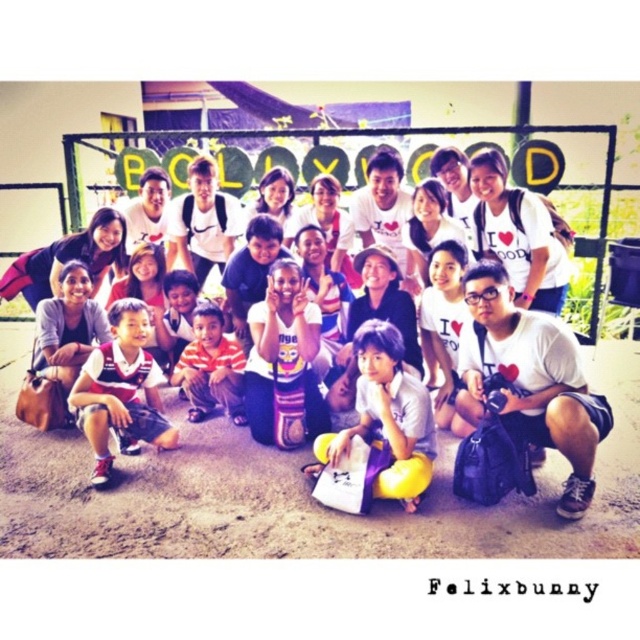
Question: Considering the real-world distances, which object is closest to the striped fabric pants at center?

Choices:
 (A) striped jersey at lower left
 (B) yellow fabric pants at lower center

Answer: (A)

Question: Is white cotton t-shirt at center closer to the viewer compared to striped jersey at lower left?

Choices:
 (A) no
 (B) yes

Answer: (B)

Question: Which point is closer to the camera?

Choices:
 (A) striped jersey at lower left
 (B) white matte plush toy at center
 (C) yellow fabric pants at lower center
 (D) white cotton t-shirt at center

Answer: (D)

Question: Is white cotton t-shirt at center wider than yellow fabric pants at lower center?

Choices:
 (A) no
 (B) yes

Answer: (A)

Question: Among these objects, which one is farthest from the camera?

Choices:
 (A) yellow fabric pants at lower center
 (B) white cotton t-shirt at center
 (C) white matte plush toy at center

Answer: (C)

Question: Observing the image, what is the correct spatial positioning of white cotton t-shirt at center in reference to striped fabric pants at center?

Choices:
 (A) right
 (B) left

Answer: (A)